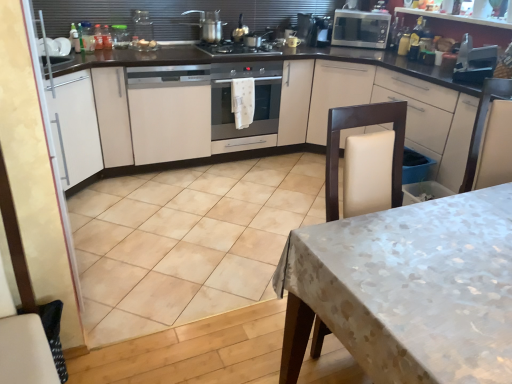
Question: Can you confirm if satin silver oven at center is positioned to the right of metallic microwave at upper right, the 2th appliance ordered from the bottom?

Choices:
 (A) no
 (B) yes

Answer: (A)

Question: Is metallic microwave at upper right, the 2th appliance ordered from the bottom, located within satin silver oven at center?

Choices:
 (A) no
 (B) yes

Answer: (A)

Question: Is satin silver oven at center facing away from metallic microwave at upper right, marked as the 2th appliance in a right-to-left arrangement?

Choices:
 (A) yes
 (B) no

Answer: (B)

Question: Does satin silver oven at center have a smaller size compared to metallic microwave at upper right, the 2th appliance ordered from the bottom?

Choices:
 (A) no
 (B) yes

Answer: (A)

Question: Is satin silver oven at center bigger than metallic microwave at upper right, the 2th appliance ordered from the bottom?

Choices:
 (A) yes
 (B) no

Answer: (A)

Question: Based on their sizes in the image, would you say black matte gas stove at center is bigger or smaller than metallic silver pot at upper center, which appears as the 1th kitchen appliance when viewed from the left?

Choices:
 (A) small
 (B) big

Answer: (A)

Question: From a real-world perspective, is black matte gas stove at center physically located above or below metallic silver pot at upper center, which appears as the 1th kitchen appliance when viewed from the left?

Choices:
 (A) below
 (B) above

Answer: (A)

Question: Considering the positions of black matte gas stove at center and metallic silver pot at upper center, which appears as the 1th kitchen appliance when viewed from the left, in the image, is black matte gas stove at center taller or shorter than metallic silver pot at upper center, which appears as the 1th kitchen appliance when viewed from the left,?

Choices:
 (A) tall
 (B) short

Answer: (B)

Question: From the image's perspective, is black matte gas stove at center located above or below metallic silver pot at upper center, which appears as the 1th kitchen appliance when viewed from the left?

Choices:
 (A) below
 (B) above

Answer: (A)

Question: From the image's perspective, is metallic microwave at upper right, marked as the 2th appliance in a right-to-left arrangement, positioned above or below metallic silver toaster at upper right, the 2th appliance positioned from the left?

Choices:
 (A) below
 (B) above

Answer: (B)

Question: From a real-world perspective, relative to metallic silver toaster at upper right, arranged as the 1th appliance when ordered from the bottom, is metallic microwave at upper right, the 1th appliance in the left-to-right sequence, vertically above or below?

Choices:
 (A) above
 (B) below

Answer: (B)

Question: Considering the relative positions of metallic microwave at upper right, the 2th appliance ordered from the bottom, and metallic silver toaster at upper right, which appears as the first appliance when viewed from the front, in the image provided, is metallic microwave at upper right, the 2th appliance ordered from the bottom, to the left or to the right of metallic silver toaster at upper right, which appears as the first appliance when viewed from the front,?

Choices:
 (A) left
 (B) right

Answer: (A)

Question: Considering their positions, is metallic microwave at upper right, marked as the 2th appliance in a right-to-left arrangement, located in front of or behind metallic silver toaster at upper right, the 2th appliance positioned from the left?

Choices:
 (A) behind
 (B) front

Answer: (A)

Question: From the image's perspective, is white matte cabinet at upper right, which is counted as the first cabinetry, starting from the right, above or below satin silver oven at center?

Choices:
 (A) above
 (B) below

Answer: (A)

Question: Is white matte cabinet at upper right, which is counted as the first cabinetry, starting from the right, taller or shorter than satin silver oven at center?

Choices:
 (A) tall
 (B) short

Answer: (A)